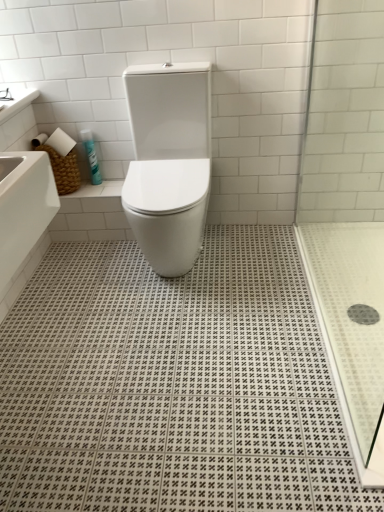
Find the location of a particular element. This screenshot has height=512, width=384. vacant space situated on the left part of blue glossy spray can at upper left is located at coordinates 83,187.